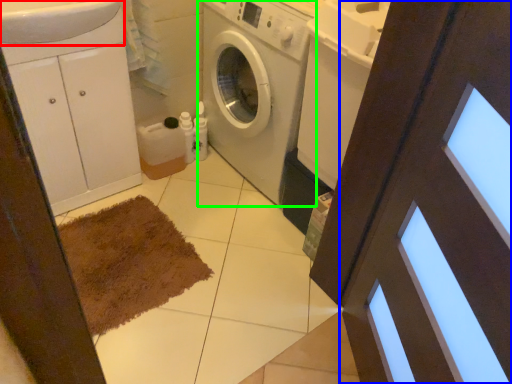
Question: Which object is positioned closest to sink (highlighted by a red box)? Select from screen door (highlighted by a blue box) and washing machine (highlighted by a green box).

Choices:
 (A) screen door
 (B) washing machine

Answer: (B)